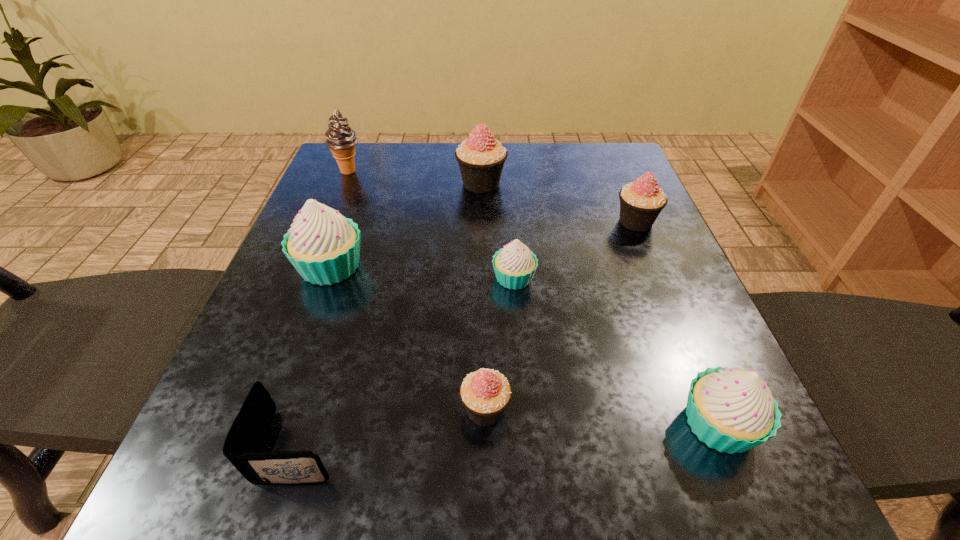
Point out which pink cupcake is positioned as the nearest to the biggest pink cupcake. Please provide its 2D coordinates. Your answer should be formatted as a tuple, i.e. [(x, y)], where the tuple contains the x and y coordinates of a point satisfying the conditions above.

[(641, 202)]

Identify which white cupcake is the closest to the rightmost white cupcake. Please provide its 2D coordinates. Your answer should be formatted as a tuple, i.e. [(x, y)], where the tuple contains the x and y coordinates of a point satisfying the conditions above.

[(514, 265)]

Where is `the closest white cupcake to the smallest white cupcake`? The image size is (960, 540). the closest white cupcake to the smallest white cupcake is located at coordinates (323, 246).

This screenshot has height=540, width=960. I want to click on vacant space that satisfies the following two spatial constraints: 1. on the front side of the nearest pink cupcake; 2. on the left side of the leftmost cupcake, so click(x=279, y=409).

Locate an element on the screen. vacant area in the image that satisfies the following two spatial constraints: 1. on the front side of the smallest white cupcake; 2. on the outer surface of the wallet is located at coordinates (527, 445).